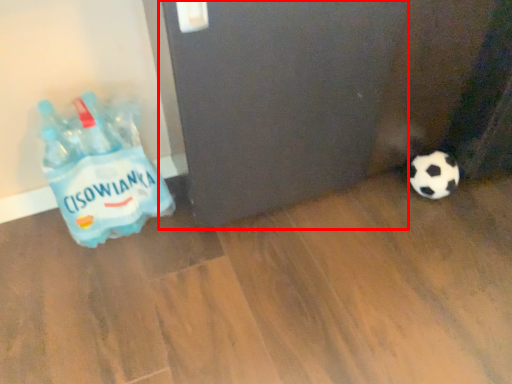
Question: Where is screen door (annotated by the red box) located in relation to bottle in the image?

Choices:
 (A) right
 (B) left

Answer: (A)